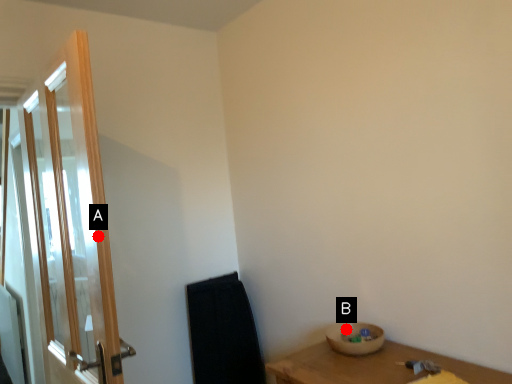
Question: Two points are circled on the image, labeled by A and B beside each circle. Which point is farther from the camera taking this photo?

Choices:
 (A) A is further
 (B) B is further

Answer: (B)